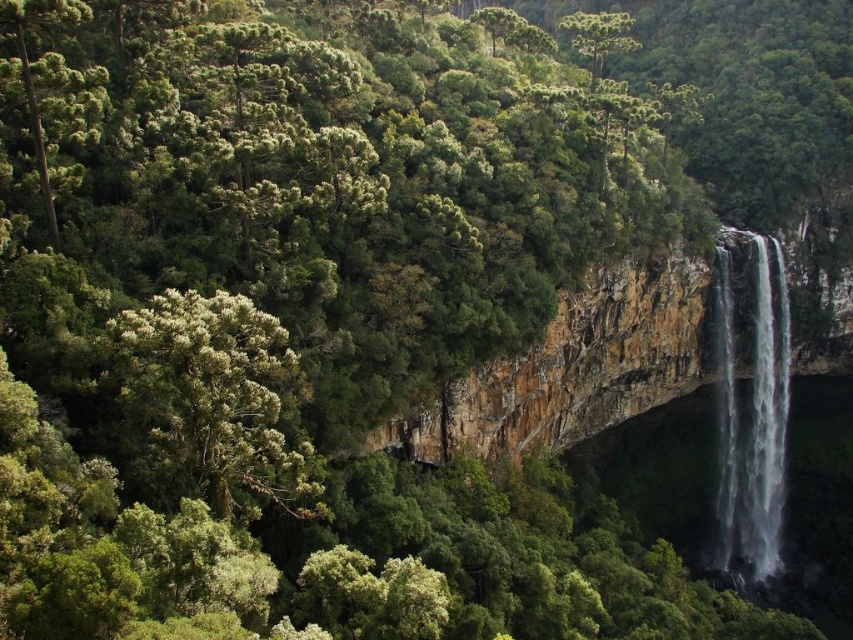
Between green leafy tree at left and clear water at right, which one is positioned lower?

clear water at right is lower down.

Locate an element on the screen. This screenshot has width=853, height=640. green leafy tree at left is located at coordinates (212, 397).

Does point (158, 401) come in front of point (764, 352)?

That is True.

Where is `green leafy tree at left`? The width and height of the screenshot is (853, 640). green leafy tree at left is located at coordinates (212, 397).